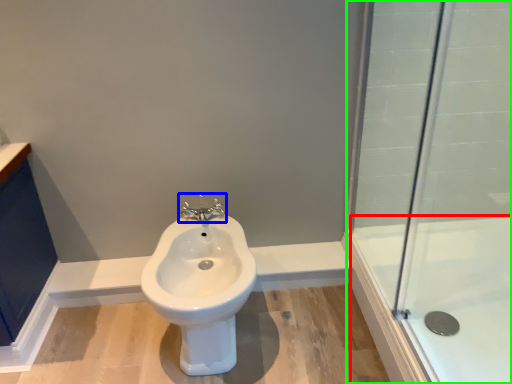
Question: Considering the real-world distances, which object is closest to bath (highlighted by a red box)? tap (highlighted by a blue box) or shower door (highlighted by a green box).

Choices:
 (A) tap
 (B) shower door

Answer: (B)